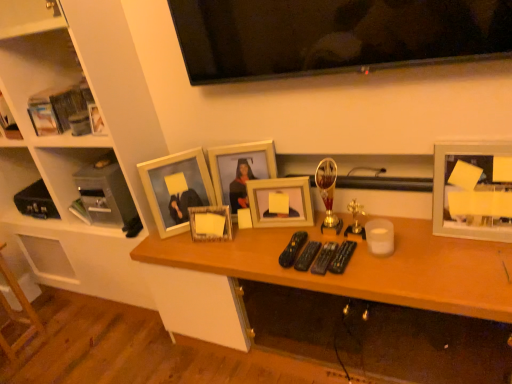
Question: Is flat screen tv at upper center oriented away from matte wooden picture frame at center, which appears as the 5th picture frame when viewed from the right?

Choices:
 (A) yes
 (B) no

Answer: (B)

Question: Can you confirm if flat screen tv at upper center is shorter than matte wooden picture frame at center, which appears as the 5th picture frame when viewed from the right?

Choices:
 (A) yes
 (B) no

Answer: (B)

Question: From a real-world perspective, is flat screen tv at upper center on top of matte wooden picture frame at center, arranged as the 1th picture frame when viewed from the left?

Choices:
 (A) no
 (B) yes

Answer: (B)

Question: From a real-world perspective, is flat screen tv at upper center positioned under matte wooden picture frame at center, arranged as the 1th picture frame when viewed from the left, based on gravity?

Choices:
 (A) no
 (B) yes

Answer: (A)

Question: Can you confirm if flat screen tv at upper center is taller than matte wooden picture frame at center, which appears as the 5th picture frame when viewed from the right?

Choices:
 (A) no
 (B) yes

Answer: (B)

Question: Is flat screen tv at upper center taller or shorter than wooden picture frame at center, the 4th picture frame in the right-to-left sequence?

Choices:
 (A) tall
 (B) short

Answer: (A)

Question: From the image's perspective, is flat screen tv at upper center located above or below wooden picture frame at center, which is the second picture frame from left to right?

Choices:
 (A) below
 (B) above

Answer: (B)

Question: Would you say flat screen tv at upper center is to the left or to the right of wooden picture frame at center, the 4th picture frame in the right-to-left sequence, in the picture?

Choices:
 (A) right
 (B) left

Answer: (A)

Question: Is flat screen tv at upper center in front of or behind wooden picture frame at center, which is the second picture frame from left to right, in the image?

Choices:
 (A) front
 (B) behind

Answer: (A)

Question: Looking at their shapes, would you say wooden desk at center is wider or thinner than wooden picture frame at center, the 4th picture frame in the right-to-left sequence?

Choices:
 (A) thin
 (B) wide

Answer: (B)

Question: From a real-world perspective, is wooden desk at center above or below wooden picture frame at center, the 4th picture frame in the right-to-left sequence?

Choices:
 (A) above
 (B) below

Answer: (B)

Question: From their relative heights in the image, would you say wooden desk at center is taller or shorter than wooden picture frame at center, which is the second picture frame from left to right?

Choices:
 (A) tall
 (B) short

Answer: (A)

Question: From the image's perspective, is wooden desk at center above or below wooden picture frame at center, which is the second picture frame from left to right?

Choices:
 (A) above
 (B) below

Answer: (B)

Question: In the image, is flat screen tv at upper center on the left side or the right side of matte wooden picture frame at center, the 3th picture frame when ordered from right to left?

Choices:
 (A) right
 (B) left

Answer: (A)

Question: From a real-world perspective, is flat screen tv at upper center physically located above or below matte wooden picture frame at center, the 3th picture frame when ordered from right to left?

Choices:
 (A) above
 (B) below

Answer: (A)